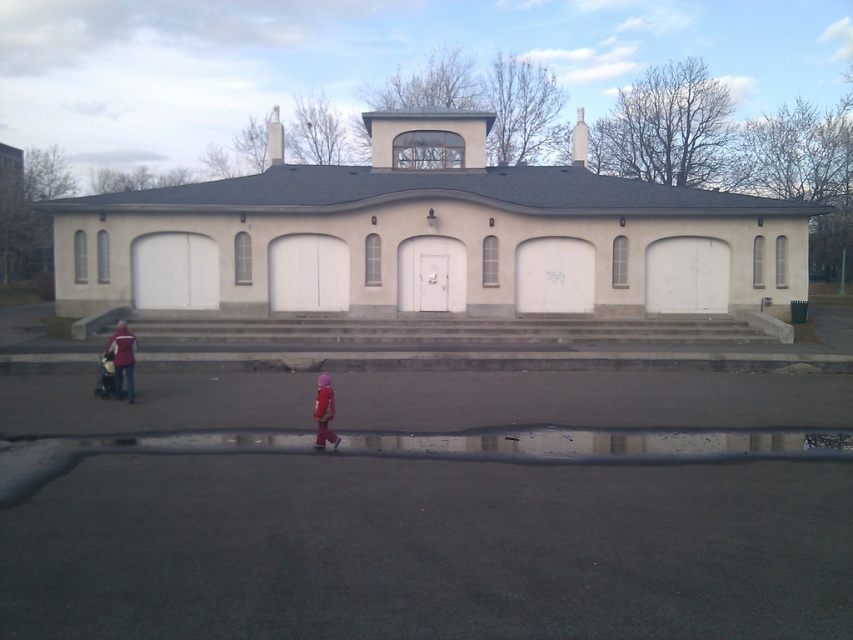
Does beige concrete building at center lie behind matte red jacket at left?

Yes.

Is point (560, 260) positioned behind point (113, 349)?

Yes, point (560, 260) is farther from viewer.

This screenshot has height=640, width=853. Find the location of `beige concrete building at center`. beige concrete building at center is located at coordinates (426, 237).

Does concrete stairs at center come behind pink fabric coat at lower center?

Yes, it is behind pink fabric coat at lower center.

Based on the photo, is concrete stairs at center above pink fabric coat at lower center?

Yes.

Image resolution: width=853 pixels, height=640 pixels. In order to click on concrete stairs at center in this screenshot , I will do `click(450, 330)`.

Describe the element at coordinates (122, 358) in the screenshot. Image resolution: width=853 pixels, height=640 pixels. I see `matte red jacket at left` at that location.

Can you confirm if matte red jacket at left is thinner than pink fabric coat at lower center?

No.

Is point (120, 362) closer to camera compared to point (317, 422)?

No, (120, 362) is further to viewer.

What are the coordinates of `matte red jacket at left` in the screenshot? It's located at (122, 358).